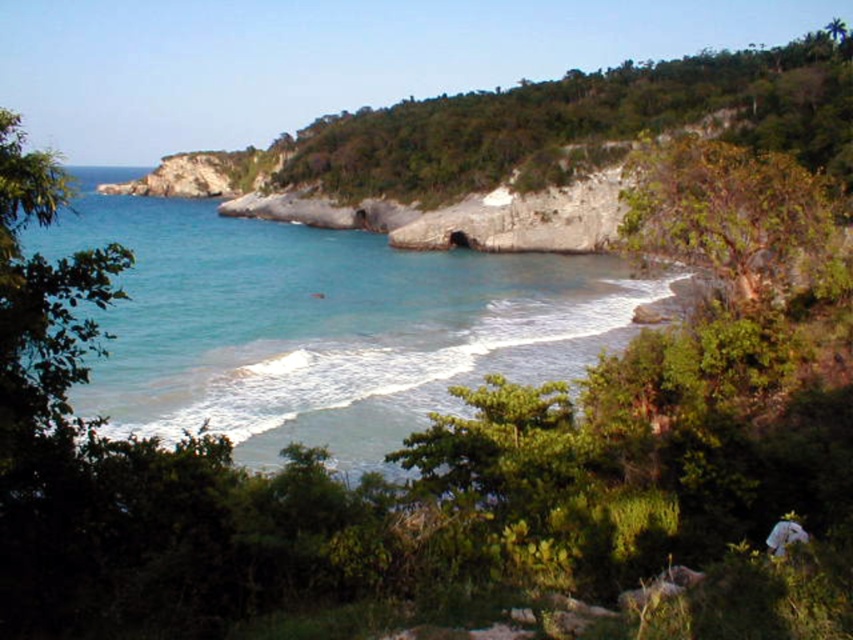
You are standing at the edge of the shoreline looking towards the bay. Which object is positioned to the left of the other between the clear blue water at center and the green leafy hillside at upper center?

The clear blue water at center is positioned to the left of the green leafy hillside at upper center.

You are standing on the shoreline looking out at the bay. There is a point marked at coordinates (318, 324). What color is the water at that exact point?

The clear blue water at center is represented by point (318, 324), so the water at that point is clear blue.

You are standing at the edge of the bay and want to take a photo of both the point at coordinates point [157,410] and point [538,168]. Which point should you focus on first to ensure both are in clear view?

You should focus on point [157,410] first because it is closer to the camera than point [538,168], ensuring both points are in focus when using depth of field.